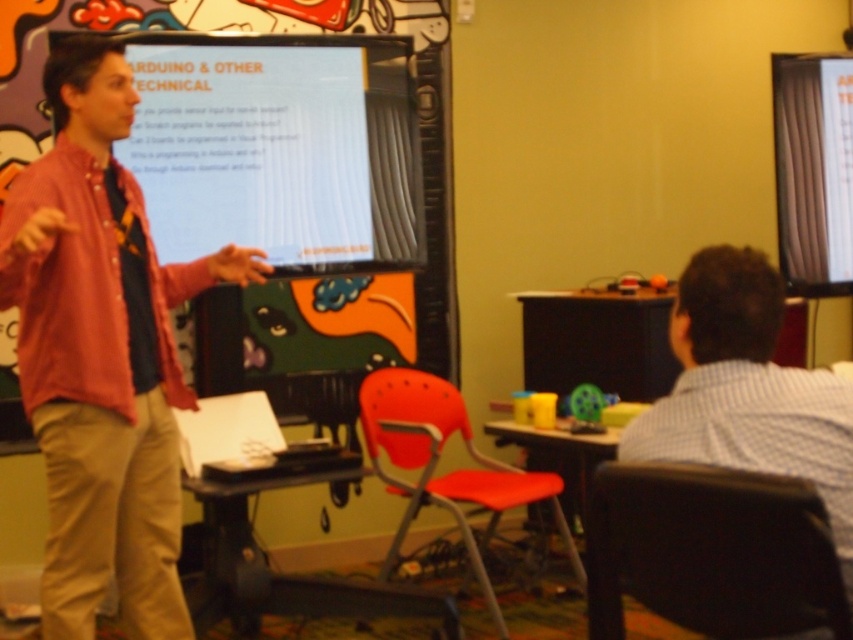
Does orange plastic chair at center have a lesser height compared to matte black projector screen at upper right?

Yes, orange plastic chair at center is shorter than matte black projector screen at upper right.

Does orange plastic chair at center appear over matte black projector screen at upper right?

Actually, orange plastic chair at center is below matte black projector screen at upper right.

Describe the element at coordinates (450, 472) in the screenshot. I see `orange plastic chair at center` at that location.

This screenshot has height=640, width=853. I want to click on orange plastic chair at center, so click(x=450, y=472).

Does white glossy projector screen at upper center come behind orange plastic chair at center?

No, it is in front of orange plastic chair at center.

Is point (407, 250) more distant than point (460, 490)?

That is True.

What are the coordinates of `white glossy projector screen at upper center` in the screenshot? It's located at (279, 148).

Does black plastic chair at lower right have a smaller size compared to white striped shirt at right?

Yes, black plastic chair at lower right is smaller than white striped shirt at right.

The height and width of the screenshot is (640, 853). Identify the location of black plastic chair at lower right. (711, 552).